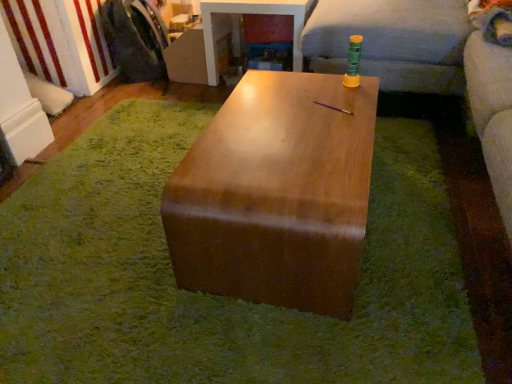
Question: From a real-world perspective, is glossy wood table at center, the 2th table when ordered from top to bottom, physically located above or below soft gray fabric couch at upper right?

Choices:
 (A) above
 (B) below

Answer: (B)

Question: Is point (248, 218) positioned closer to the camera than point (411, 77)?

Choices:
 (A) closer
 (B) farther

Answer: (A)

Question: Considering the real-world distances, which object is closest to the glossy wood table at center, the second table viewed from the back?

Choices:
 (A) brushed metal washing machine at left
 (B) soft gray fabric couch at upper right
 (C) glossy wood table at center, which is the 2th table from bottom to top
 (D) wooden table at center

Answer: (D)

Question: Which is farther from the soft gray fabric couch at upper right?

Choices:
 (A) glossy wood table at center, arranged as the first table when viewed from the front
 (B) wooden table at center
 (C) brushed metal washing machine at left
 (D) glossy wood table at center, the first table viewed from the top

Answer: (C)